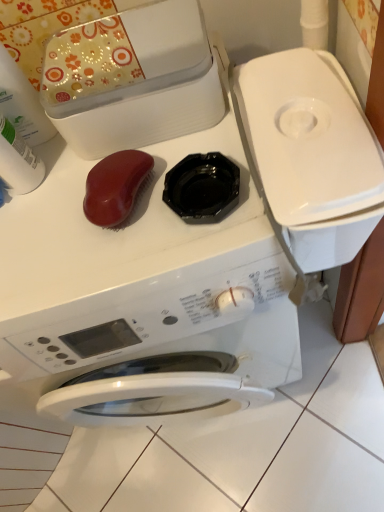
Question: Should I look upward or downward to see white plastic bottle at left, marked as the 2th cleaning product in a top-to-bottom arrangement?

Choices:
 (A) down
 (B) up

Answer: (B)

Question: Is the depth of white plastic bottle at left, marked as the 2th cleaning product in a top-to-bottom arrangement, less than that of white glossy washing machine at center?

Choices:
 (A) no
 (B) yes

Answer: (A)

Question: From a real-world perspective, is white plastic bottle at left, marked as the 2th cleaning product in a top-to-bottom arrangement, positioned under white glossy washing machine at center based on gravity?

Choices:
 (A) yes
 (B) no

Answer: (B)

Question: Can you confirm if white plastic bottle at left, marked as the 2th cleaning product in a top-to-bottom arrangement, is wider than white glossy washing machine at center?

Choices:
 (A) yes
 (B) no

Answer: (B)

Question: Is white plastic bottle at left, placed as the 1th cleaning product when sorted from bottom to top, positioned behind white glossy washing machine at center?

Choices:
 (A) no
 (B) yes

Answer: (B)

Question: Is white plastic bottle at left, placed as the 1th cleaning product when sorted from bottom to top, facing away from white glossy washing machine at center?

Choices:
 (A) yes
 (B) no

Answer: (B)

Question: Does white plastic bottle at left, marked as the 2th cleaning product in a top-to-bottom arrangement, have a lesser width compared to white glossy washing machine at center?

Choices:
 (A) no
 (B) yes

Answer: (B)

Question: Is white plastic bottle at upper left, which ranks as the second cleaning product in bottom-to-top order, smaller than white glossy washing machine at center?

Choices:
 (A) no
 (B) yes

Answer: (B)

Question: From the image's perspective, does white plastic bottle at upper left, which ranks as the second cleaning product in bottom-to-top order, appear lower than white glossy washing machine at center?

Choices:
 (A) yes
 (B) no

Answer: (B)

Question: Is white plastic bottle at upper left, which is the 1th cleaning product from top to bottom, far away from white glossy washing machine at center?

Choices:
 (A) no
 (B) yes

Answer: (A)

Question: From a real-world perspective, is white plastic bottle at upper left, which is the 1th cleaning product from top to bottom, positioned over white glossy washing machine at center based on gravity?

Choices:
 (A) no
 (B) yes

Answer: (B)

Question: Is white plastic bottle at upper left, which is the 1th cleaning product from top to bottom, positioned in front of white glossy washing machine at center?

Choices:
 (A) yes
 (B) no

Answer: (B)

Question: Does white plastic bottle at upper left, which ranks as the second cleaning product in bottom-to-top order, have a larger size compared to white glossy washing machine at center?

Choices:
 (A) no
 (B) yes

Answer: (A)

Question: Is white plastic bottle at upper left, which ranks as the second cleaning product in bottom-to-top order, to the left of white plastic bottle at left, placed as the 1th cleaning product when sorted from bottom to top, from the viewer's perspective?

Choices:
 (A) no
 (B) yes

Answer: (B)